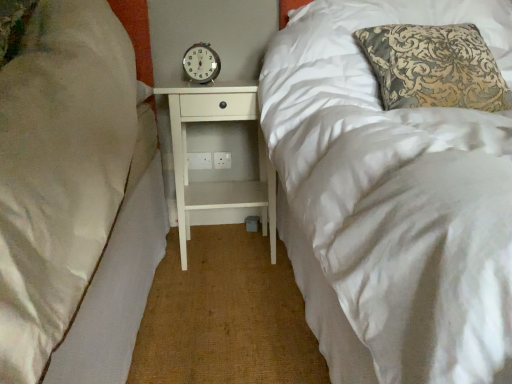
I want to click on free region under white wood nightstand at center (from a real-world perspective), so click(227, 251).